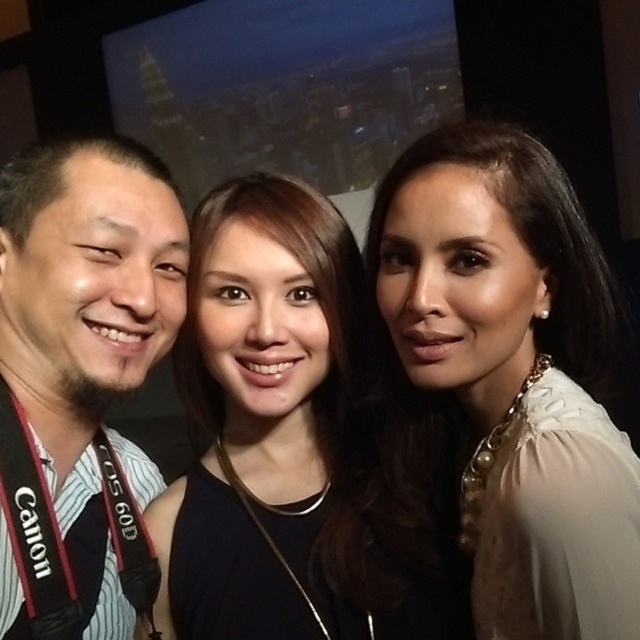
Question: Is white pearl necklace at upper right positioned at the back of black fabric dress at center?

Choices:
 (A) yes
 (B) no

Answer: (B)

Question: Can you confirm if white pearl necklace at upper right is bigger than matte black shirt at left?

Choices:
 (A) yes
 (B) no

Answer: (A)

Question: Among these points, which one is farthest from the camera?

Choices:
 (A) (600, 470)
 (B) (269, 337)
 (C) (58, 420)

Answer: (C)

Question: Can you confirm if white pearl necklace at upper right is smaller than matte black shirt at left?

Choices:
 (A) yes
 (B) no

Answer: (B)

Question: Which object is closer to the camera taking this photo?

Choices:
 (A) matte black shirt at left
 (B) white pearl necklace at upper right

Answer: (B)

Question: Considering the real-world distances, which object is farthest from the black fabric dress at center?

Choices:
 (A) white pearl necklace at upper right
 (B) matte black shirt at left

Answer: (A)